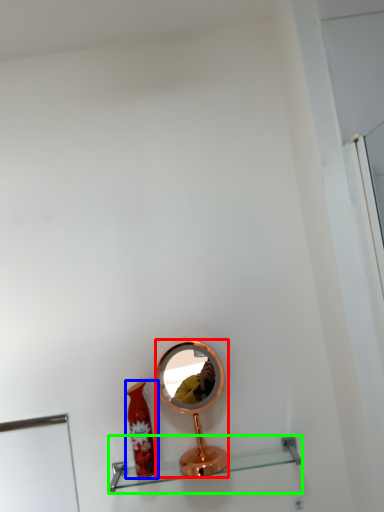
Question: Considering the real-world distances, which object is farthest from mirror (highlighted by a red box)? bottle (highlighted by a blue box) or shelf (highlighted by a green box)?

Choices:
 (A) bottle
 (B) shelf

Answer: (B)